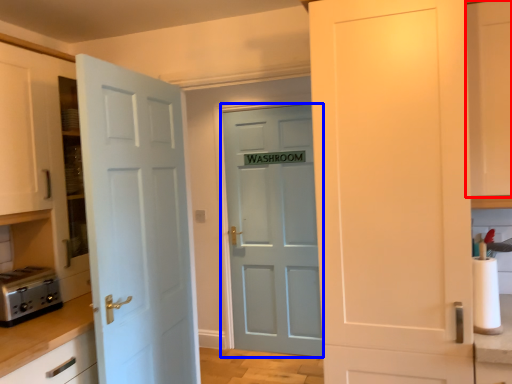
Question: Among these objects, which one is nearest to the camera, cabinetry (highlighted by a red box) or door (highlighted by a blue box)?

Choices:
 (A) cabinetry
 (B) door

Answer: (A)